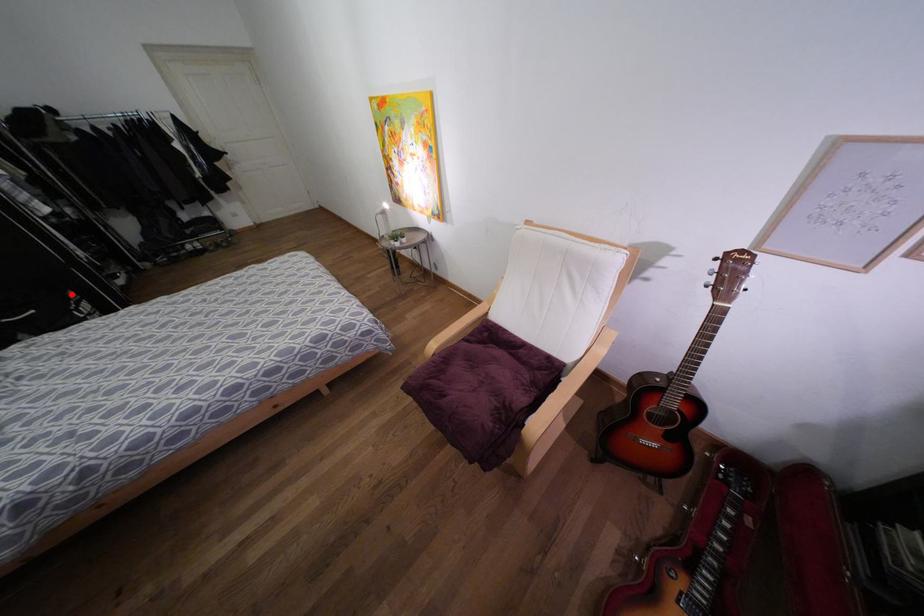
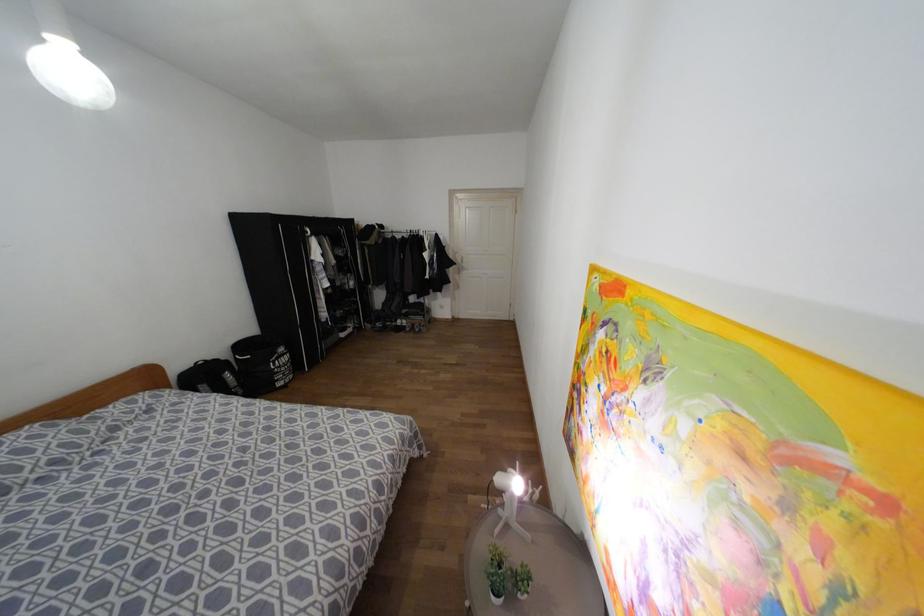
The point at the highlighted location is marked in the first image. Where is the corresponding point in the second image?

(281, 349)